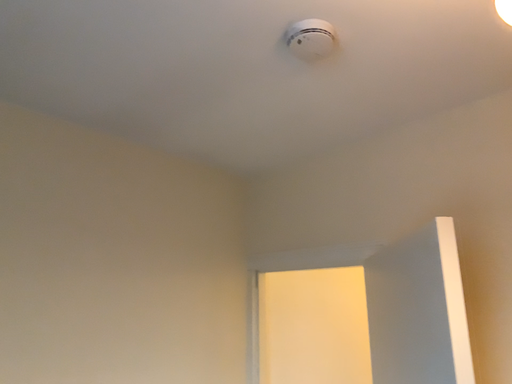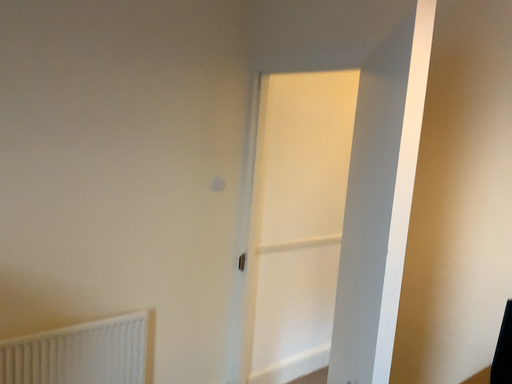
Question: How did the camera likely rotate when shooting the video?

Choices:
 (A) rotated left
 (B) rotated right

Answer: (A)